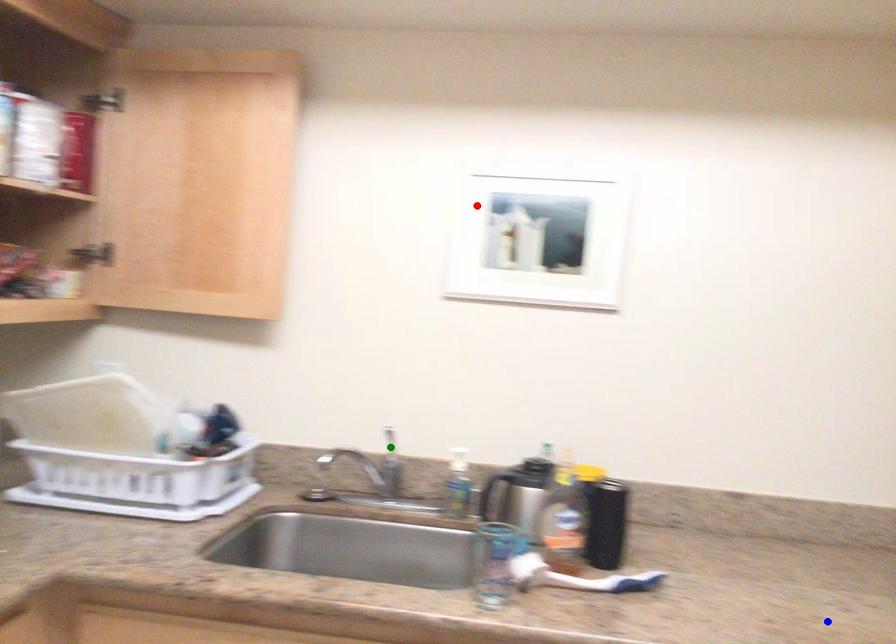
Based on the photo, order these from farthest to nearest:
red point
blue point
green point

green point, red point, blue point